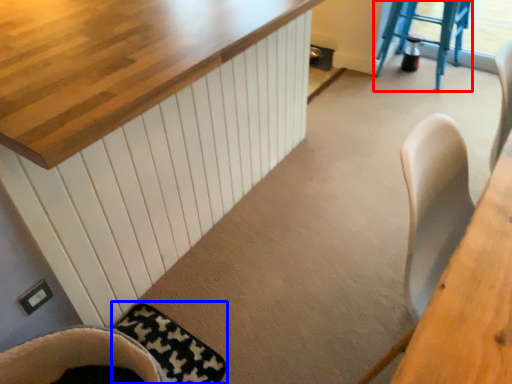
Question: Which point is further to the camera, step stool (highlighted by a red box) or mat (highlighted by a blue box)?

Choices:
 (A) step stool
 (B) mat

Answer: (A)